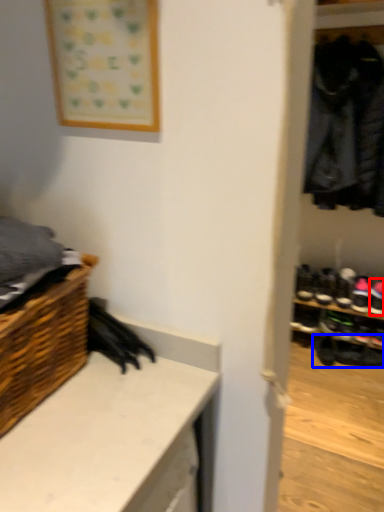
Question: Among these objects, which one is nearest to the camera, footwear (highlighted by a red box) or footwear (highlighted by a blue box)?

Choices:
 (A) footwear
 (B) footwear

Answer: (A)